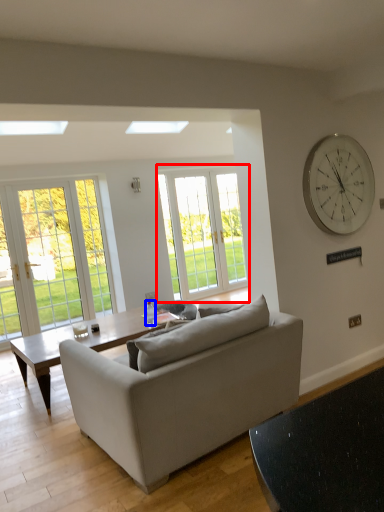
Question: Which of the following is the closest to the observer, window (highlighted by a red box) or bottle (highlighted by a blue box)?

Choices:
 (A) window
 (B) bottle

Answer: (B)